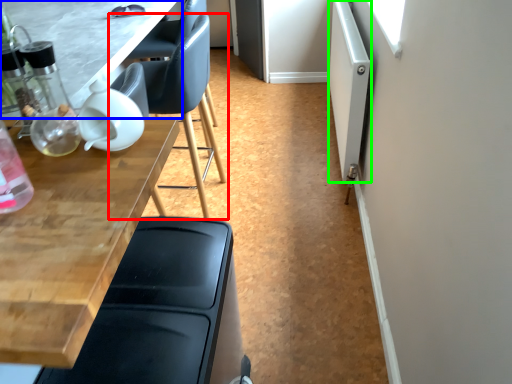
Question: Which object is positioned closest to chair (highlighted by a red box)? Select from table (highlighted by a blue box) and screen door (highlighted by a green box).

Choices:
 (A) table
 (B) screen door

Answer: (A)